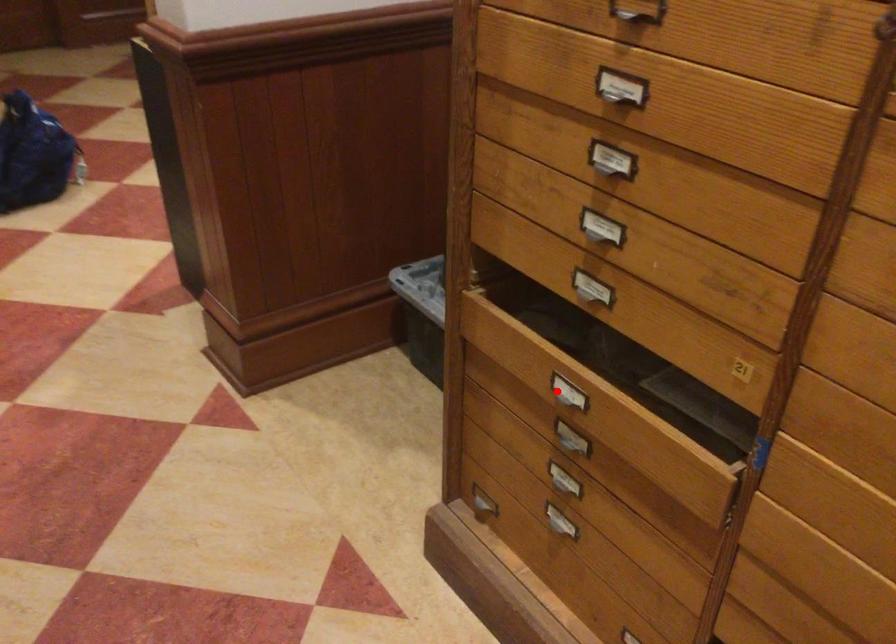
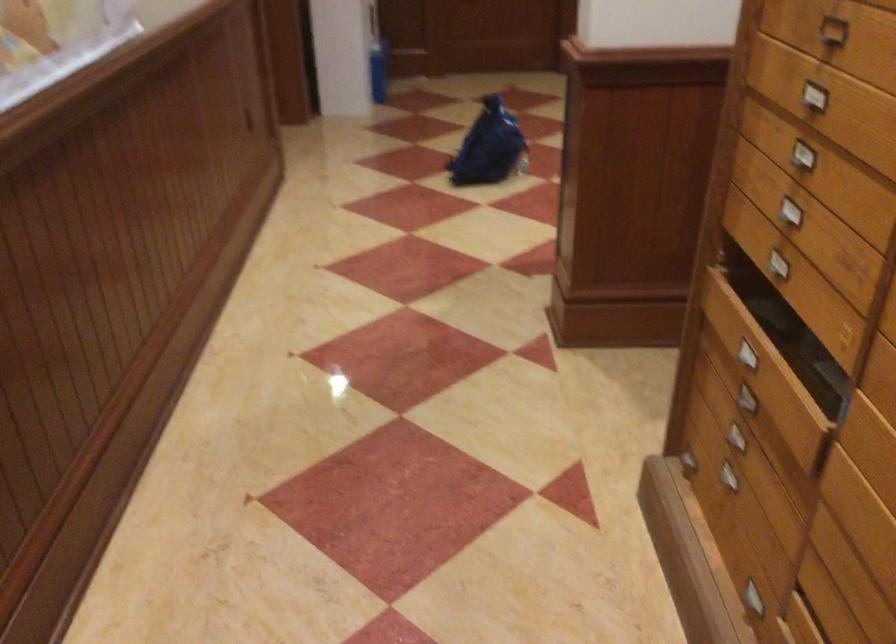
Question: I am providing you with two images of the same scene from different viewpoints. Given a red point in image1, look at the same physical point in image2. Is it:

Choices:
 (A) Closer to the viewpoint
 (B) Farther from the viewpoint

Answer: (B)